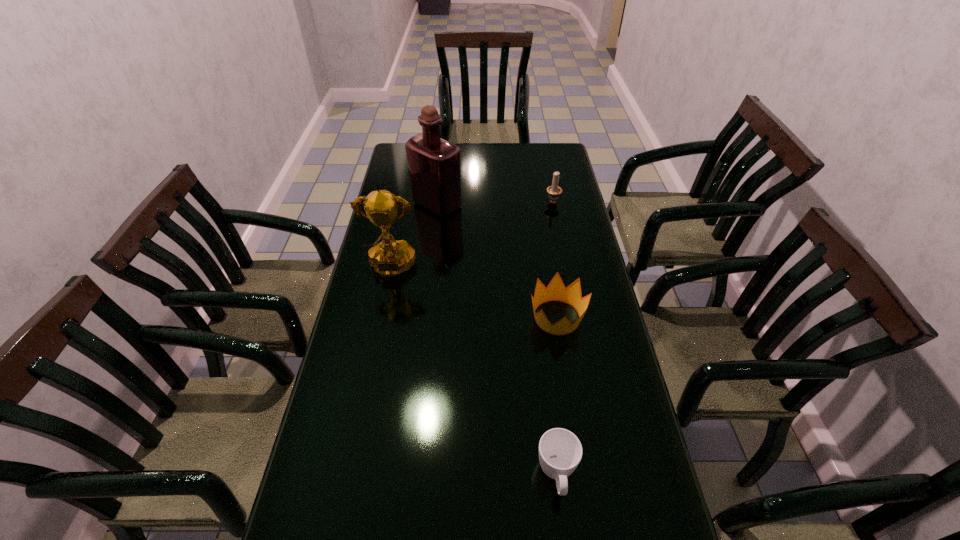
At what (x,y) coordinates should I click in order to perform the action: click on vacant point located between the third tallest object and the cup. Please return your answer as a coordinate pair (x, y). The image size is (960, 540). Looking at the image, I should click on (555, 338).

Choose which object is the second nearest neighbor to the second nearest object. Please provide its 2D coordinates. Your answer should be formatted as a tuple, i.e. [(x, y)], where the tuple contains the x and y coordinates of a point satisfying the conditions above.

[(389, 258)]

Locate which object is the second closest to the liquor. Please provide its 2D coordinates. Your answer should be formatted as a tuple, i.e. [(x, y)], where the tuple contains the x and y coordinates of a point satisfying the conditions above.

[(554, 191)]

Where is `free space in the image that satisfies the following two spatial constraints: 1. on the front side of the crown; 2. on the left side of the award`? The image size is (960, 540). free space in the image that satisfies the following two spatial constraints: 1. on the front side of the crown; 2. on the left side of the award is located at coordinates (381, 318).